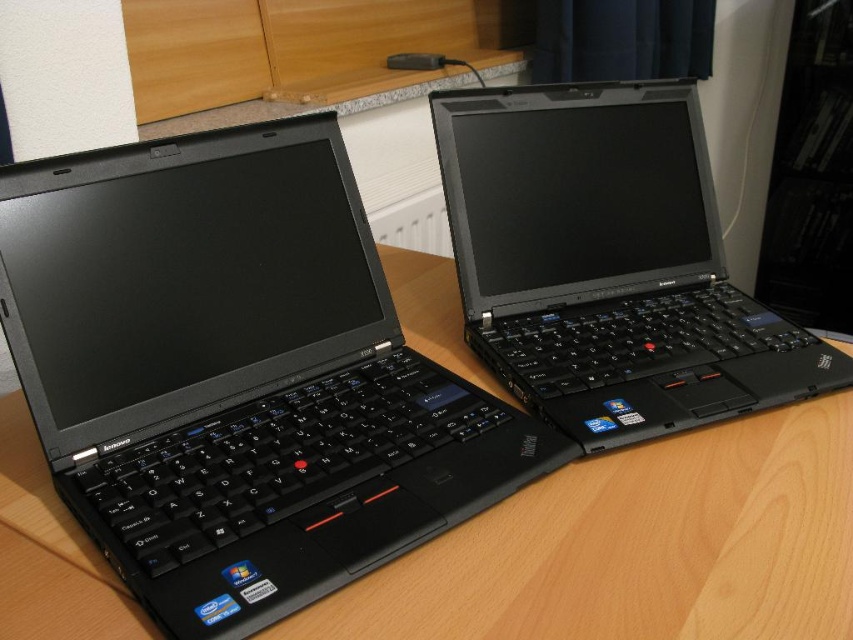
Question: Which point is farther from the camera taking this photo?

Choices:
 (A) (746, 369)
 (B) (474, 628)

Answer: (A)

Question: Among these objects, which one is nearest to the camera?

Choices:
 (A) black matte laptop at upper right
 (B) wooden table at center

Answer: (B)

Question: Can you confirm if wooden table at center is positioned to the left of black matte laptop at upper right?

Choices:
 (A) yes
 (B) no

Answer: (A)

Question: Is wooden table at center to the left of black matte laptop at upper right from the viewer's perspective?

Choices:
 (A) no
 (B) yes

Answer: (B)

Question: From the image, what is the correct spatial relationship of wooden table at center in relation to black matte laptop at upper right?

Choices:
 (A) below
 (B) above

Answer: (A)

Question: Which object is closer to the camera taking this photo?

Choices:
 (A) wooden table at center
 (B) black matte laptop at upper right

Answer: (A)